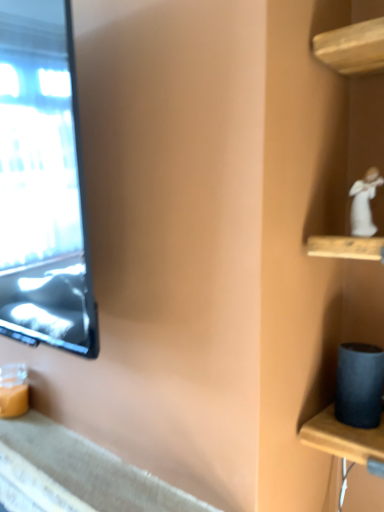
Question: In terms of width, does white porcelain figurine at upper right look wider or thinner when compared to textured gray fabric at lower left?

Choices:
 (A) thin
 (B) wide

Answer: (A)

Question: From a real-world perspective, is white porcelain figurine at upper right physically located above or below textured gray fabric at lower left?

Choices:
 (A) above
 (B) below

Answer: (A)

Question: Based on their positions, is white porcelain figurine at upper right located to the left or right of textured gray fabric at lower left?

Choices:
 (A) right
 (B) left

Answer: (A)

Question: Looking at their shapes, would you say textured gray fabric at lower left is wider or thinner than white porcelain figurine at upper right?

Choices:
 (A) thin
 (B) wide

Answer: (B)

Question: From a real-world perspective, relative to white porcelain figurine at upper right, is textured gray fabric at lower left vertically above or below?

Choices:
 (A) above
 (B) below

Answer: (B)

Question: Relative to white porcelain figurine at upper right, is textured gray fabric at lower left in front or behind?

Choices:
 (A) behind
 (B) front

Answer: (B)

Question: From the image's perspective, is textured gray fabric at lower left located above or below white porcelain figurine at upper right?

Choices:
 (A) above
 (B) below

Answer: (B)